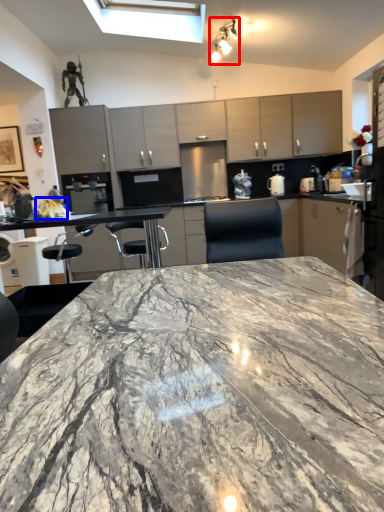
Question: Which of the following is the closest to the observer, light fixture (highlighted by a red box) or food (highlighted by a blue box)?

Choices:
 (A) light fixture
 (B) food

Answer: (B)